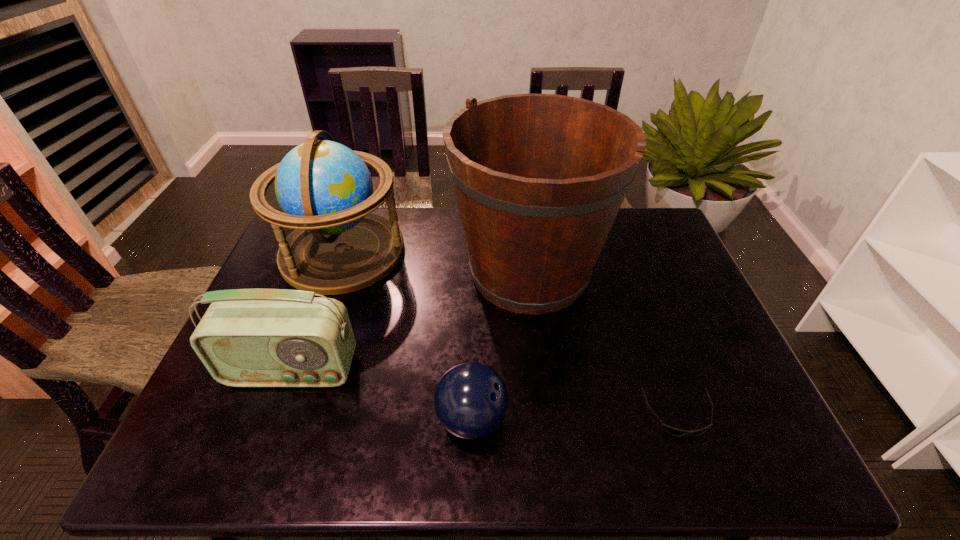
This screenshot has height=540, width=960. Find the location of `vacant space that is in between the third tallest object and the second shortest object`. vacant space that is in between the third tallest object and the second shortest object is located at coordinates (382, 395).

Identify the location of free space between the shortest object and the bowling ball. (575, 417).

This screenshot has height=540, width=960. In order to click on object that stands as the fourth closest to the bowling ball in this screenshot , I will do `click(324, 188)`.

You are a GUI agent. You are given a task and a screenshot of the screen. Output one action in this format:
    pyautogui.click(x=<x>, y=<y>)
    Task: Click on the second closest object relative to the bowling ball
    The width and height of the screenshot is (960, 540).
    Given the screenshot: What is the action you would take?
    pyautogui.click(x=247, y=337)

Image resolution: width=960 pixels, height=540 pixels. Identify the location of free space that satisfies the following two spatial constraints: 1. on the front side of the second tallest object; 2. on the right side of the bucket. (335, 273).

Where is `vacant space that satisfies the following two spatial constraints: 1. on the front side of the bucket; 2. on the surface of the bowling ball near the finger holes`? The width and height of the screenshot is (960, 540). vacant space that satisfies the following two spatial constraints: 1. on the front side of the bucket; 2. on the surface of the bowling ball near the finger holes is located at coordinates click(546, 420).

Where is `vacant position in the image that satisfies the following two spatial constraints: 1. on the front-facing side of the sunglasses; 2. on the surface of the fourth tallest object near the finger holes`? The width and height of the screenshot is (960, 540). vacant position in the image that satisfies the following two spatial constraints: 1. on the front-facing side of the sunglasses; 2. on the surface of the fourth tallest object near the finger holes is located at coordinates (681, 420).